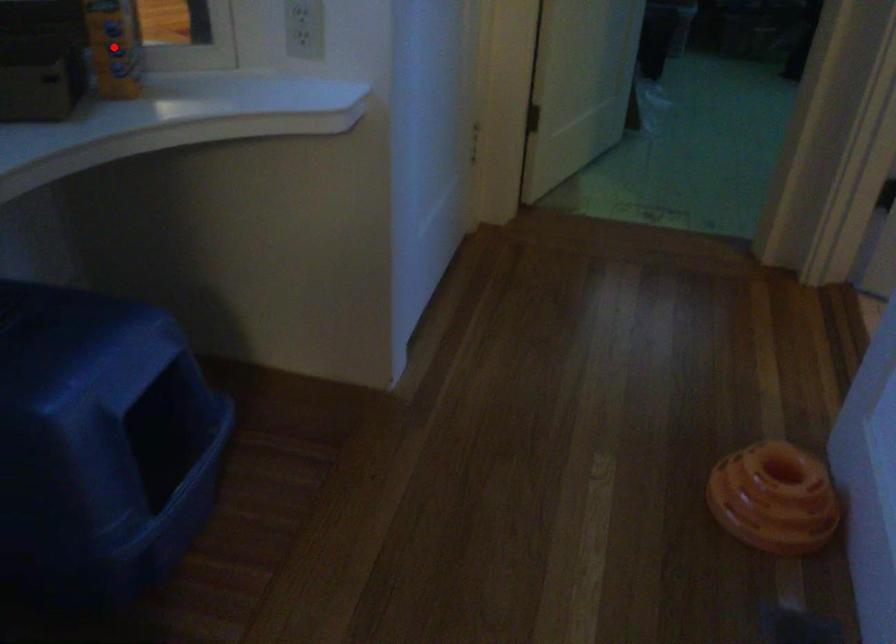
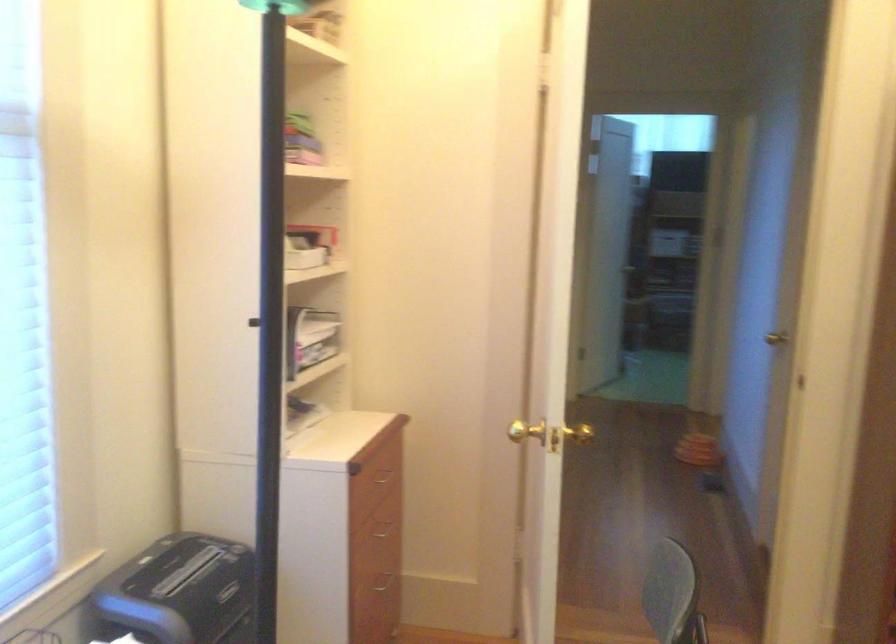
Question: I am providing you with two images of the same scene from different viewpoints. A red point is marked on the first image. At the location where the point appears in image 1, is it still visible in image 2?

Choices:
 (A) Yes
 (B) No

Answer: (B)